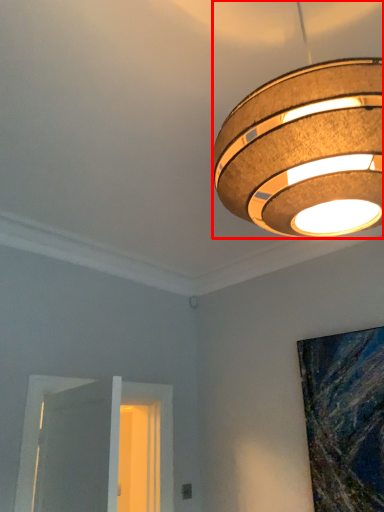
Question: From the image's perspective, considering the relative positions of lamp (annotated by the red box) and window in the image provided, where is lamp (annotated by the red box) located with respect to the staircase?

Choices:
 (A) above
 (B) below

Answer: (A)